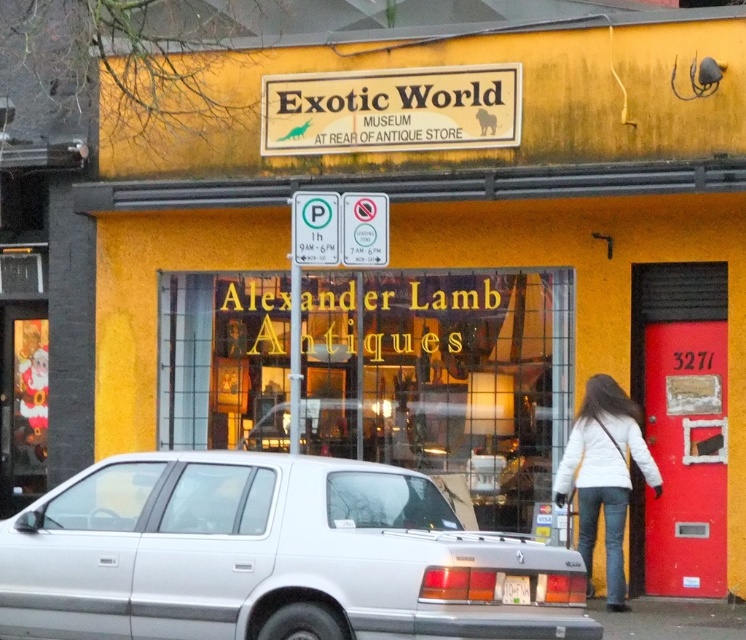
Question: Can you confirm if white matte jacket at lower right is smaller than white plastic license plate at rear?

Choices:
 (A) no
 (B) yes

Answer: (A)

Question: Based on their relative distances, which object is farther from the silver metallic sedan at lower center?

Choices:
 (A) white plastic license plate at rear
 (B) white matte jacket at lower right

Answer: (B)

Question: Among these objects, which one is farthest from the camera?

Choices:
 (A) silver metallic sedan at lower center
 (B) white matte jacket at lower right

Answer: (B)

Question: Is silver metallic sedan at lower center to the left of white plastic license plate at rear from the viewer's perspective?

Choices:
 (A) yes
 (B) no

Answer: (A)

Question: Is silver metallic sedan at lower center positioned at the back of white matte jacket at lower right?

Choices:
 (A) yes
 (B) no

Answer: (B)

Question: Which object is the farthest from the silver metallic sedan at lower center?

Choices:
 (A) white matte jacket at lower right
 (B) white plastic license plate at rear

Answer: (A)